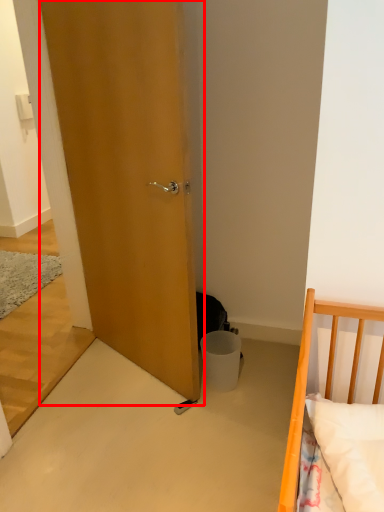
Question: From the image's perspective, what is the correct spatial positioning of door (annotated by the red box) in reference to trash bin/can?

Choices:
 (A) below
 (B) above

Answer: (B)